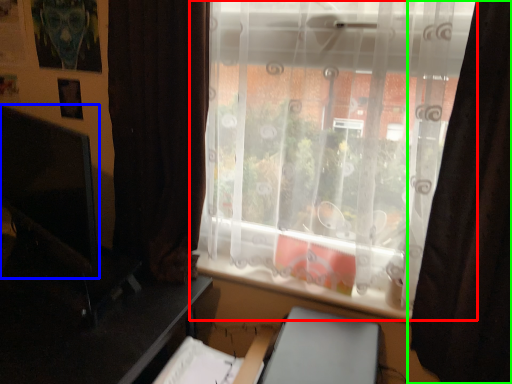
Question: Based on their relative distances, which object is farther from window (highlighted by a red box)? Choose from computer monitor (highlighted by a blue box) and curtain (highlighted by a green box).

Choices:
 (A) computer monitor
 (B) curtain

Answer: (A)